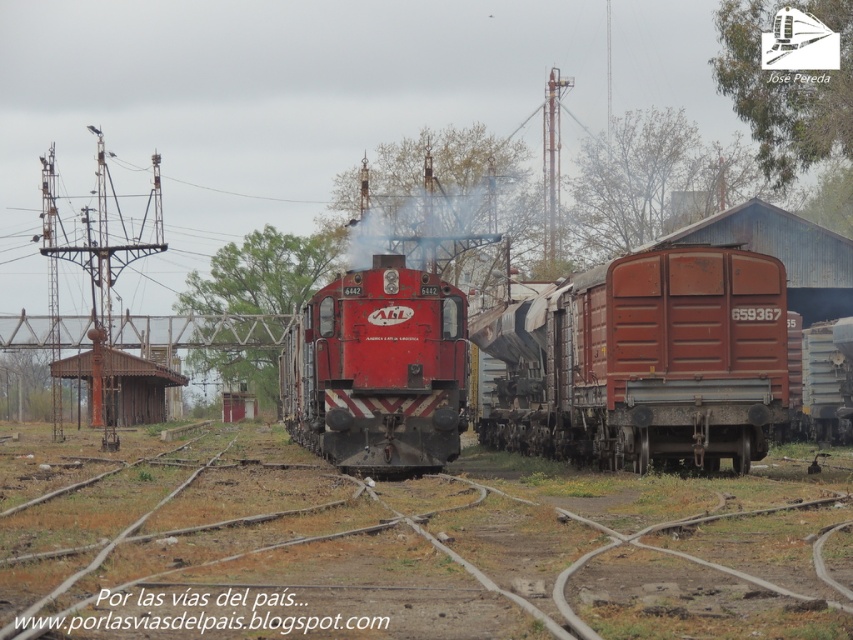
Is brown dirt train track at center further to camera compared to rusty metal train car at right?

That is False.

Can you confirm if brown dirt train track at center is shorter than rusty metal train car at right?

Result: Correct, brown dirt train track at center is not as tall as rusty metal train car at right.

Is point (450, 541) positioned before point (520, 390)?

Yes, it is in front of point (520, 390).

Locate an element on the screen. brown dirt train track at center is located at coordinates (403, 545).

Which is above, rusty metal train car at right or shiny red locomotive at center?

Positioned higher is rusty metal train car at right.

Can you confirm if rusty metal train car at right is positioned above shiny red locomotive at center?

Correct, rusty metal train car at right is located above shiny red locomotive at center.

This screenshot has width=853, height=640. I want to click on rusty metal train car at right, so click(642, 362).

Does point (71, 449) come in front of point (386, 276)?

No, it is behind (386, 276).

Identify the location of brown dirt train track at center. (403, 545).